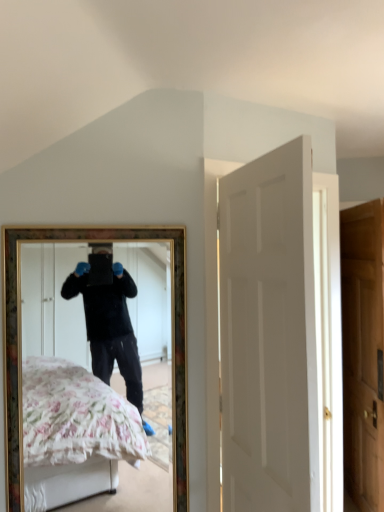
Question: From the image's perspective, is wooden door at right, the first door from the back, beneath gold-framed mirror at center?

Choices:
 (A) yes
 (B) no

Answer: (A)

Question: Is wooden door at right, the first door from the back, aimed at gold-framed mirror at center?

Choices:
 (A) yes
 (B) no

Answer: (B)

Question: Is wooden door at right, the first door from the back, with gold-framed mirror at center?

Choices:
 (A) no
 (B) yes

Answer: (A)

Question: Is wooden door at right, which is counted as the first door, starting from the right, bigger than gold-framed mirror at center?

Choices:
 (A) no
 (B) yes

Answer: (B)

Question: Is wooden door at right, which is counted as the first door, starting from the right, positioned before gold-framed mirror at center?

Choices:
 (A) no
 (B) yes

Answer: (A)

Question: Considering the relative positions of wooden door at right, which is counted as the first door, starting from the right, and gold-framed mirror at center in the image provided, is wooden door at right, which is counted as the first door, starting from the right, behind gold-framed mirror at center?

Choices:
 (A) no
 (B) yes

Answer: (B)

Question: Is gold-framed mirror at center positioned behind wooden door at right, placed as the 2th door when sorted from front to back?

Choices:
 (A) yes
 (B) no

Answer: (B)

Question: Does gold-framed mirror at center appear on the left side of wooden door at right, placed as the 2th door when sorted from front to back?

Choices:
 (A) yes
 (B) no

Answer: (A)

Question: Is gold-framed mirror at center oriented away from wooden door at right, marked as the second door in a left-to-right arrangement?

Choices:
 (A) no
 (B) yes

Answer: (A)

Question: Does gold-framed mirror at center turn towards wooden door at right, placed as the 2th door when sorted from front to back?

Choices:
 (A) no
 (B) yes

Answer: (A)

Question: Can wooden door at right, placed as the 2th door when sorted from front to back, be found inside gold-framed mirror at center?

Choices:
 (A) no
 (B) yes

Answer: (A)

Question: Is gold-framed mirror at center positioned in front of wooden door at right, placed as the 2th door when sorted from front to back?

Choices:
 (A) no
 (B) yes

Answer: (B)

Question: Is white matte door at center, which is the first door in left-to-right order, at the back of gold-framed mirror at center?

Choices:
 (A) no
 (B) yes

Answer: (A)